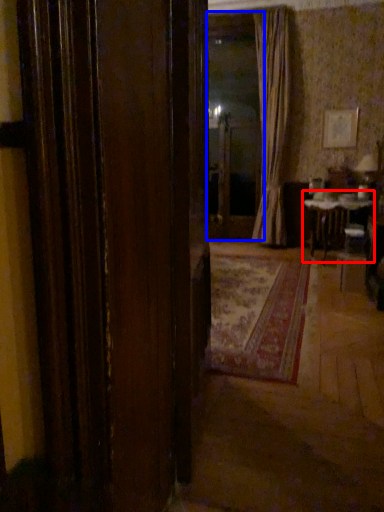
Question: Among these objects, which one is nearest to the camera, table (highlighted by a red box) or window screen (highlighted by a blue box)?

Choices:
 (A) table
 (B) window screen

Answer: (A)